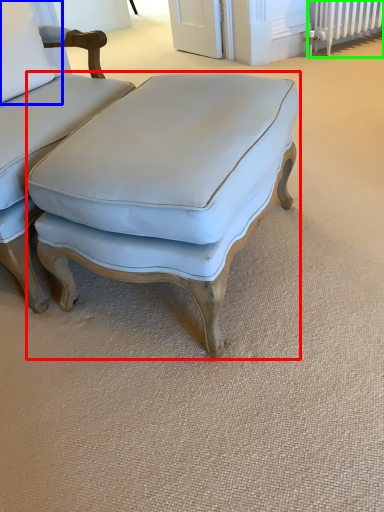
Question: Based on their relative distances, which object is nearer to studio couch (highlighted by a red box)? Choose from pillow (highlighted by a blue box) and radiator (highlighted by a green box).

Choices:
 (A) pillow
 (B) radiator

Answer: (A)